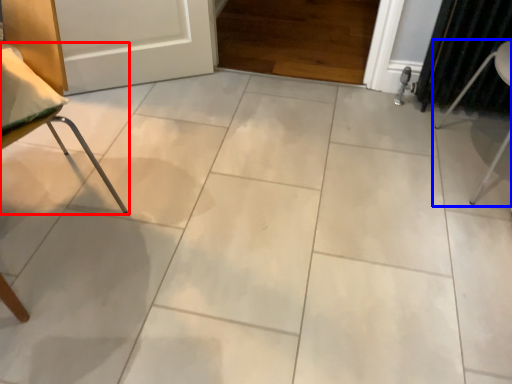
Question: Among these objects, which one is nearest to the camera, furniture (highlighted by a red box) or furniture (highlighted by a blue box)?

Choices:
 (A) furniture
 (B) furniture

Answer: (A)